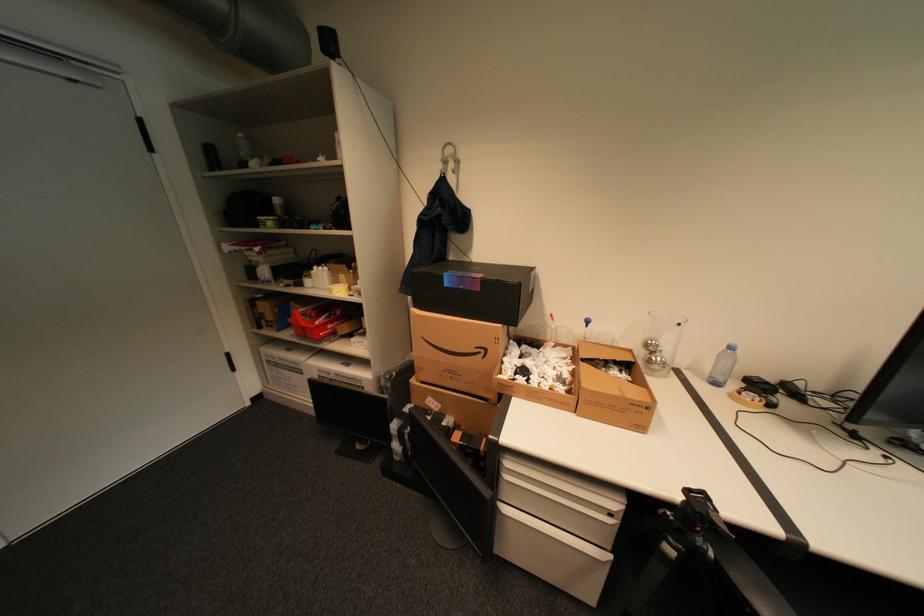
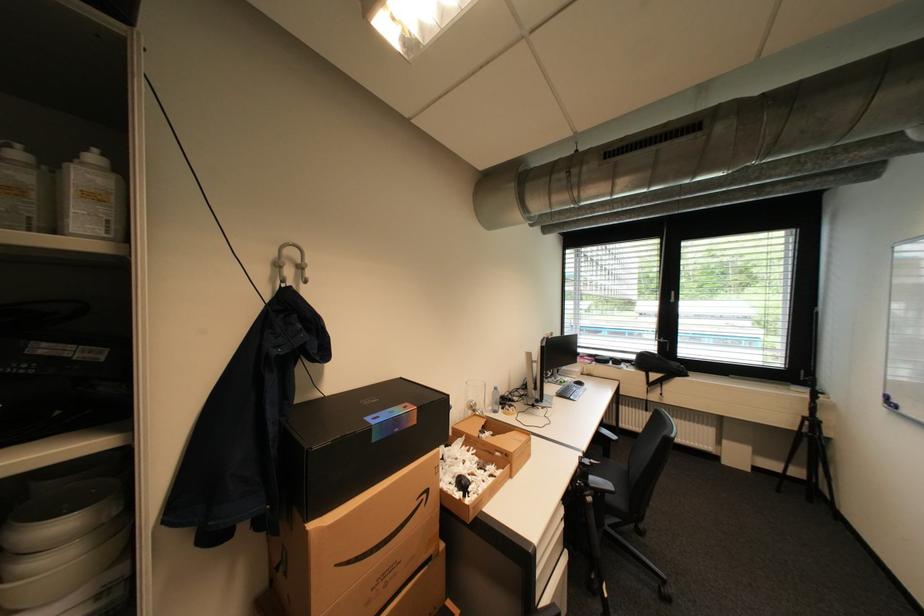
Find the pixel in the second image that matches point (686, 525) in the first image.

(591, 485)